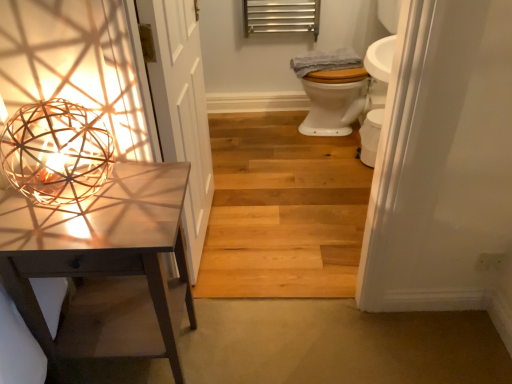
In order to click on vacant location below metallic silver radiator at upper center (from a real-world perspective) in this screenshot , I will do `click(278, 96)`.